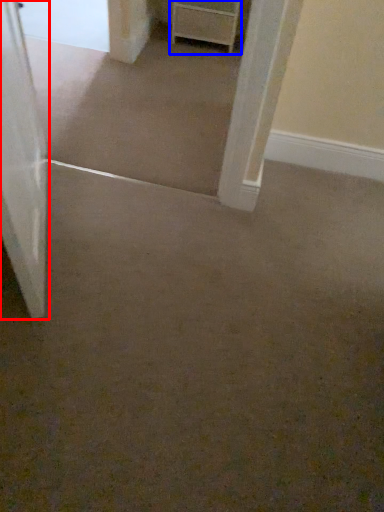
Question: Which point is closer to the camera, door (highlighted by a red box) or chest of drawers (highlighted by a blue box)?

Choices:
 (A) door
 (B) chest of drawers

Answer: (A)